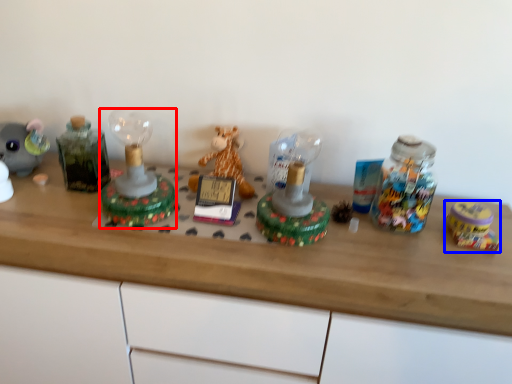
Question: Among these objects, which one is nearest to the camera, toy (highlighted by a red box) or toy (highlighted by a blue box)?

Choices:
 (A) toy
 (B) toy

Answer: (A)